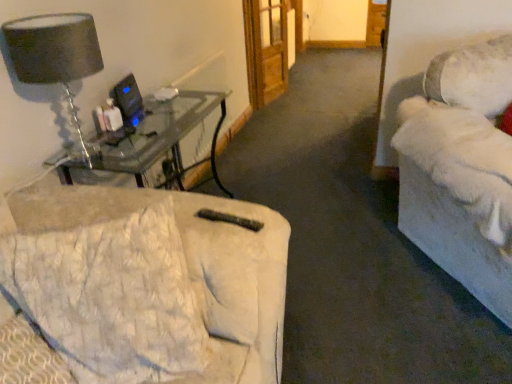
You are a GUI agent. You are given a task and a screenshot of the screen. Output one action in this format:
    pyautogui.click(x=<x>, y=<y>)
    Task: Click on the free space in front of black plastic computer monitor at upper left
    
    Given the screenshot: What is the action you would take?
    pyautogui.click(x=141, y=130)